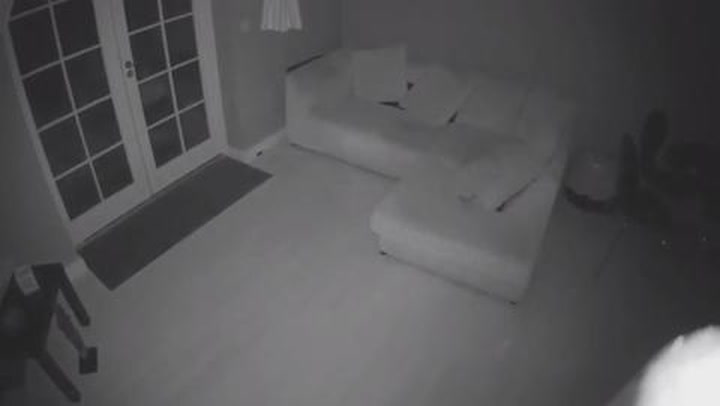
At what (x,y) coordinates should I click in order to perform the action: click on side table top. Please return your answer as a coordinate pair (x, y). The width and height of the screenshot is (720, 406). Looking at the image, I should click on (35, 320).